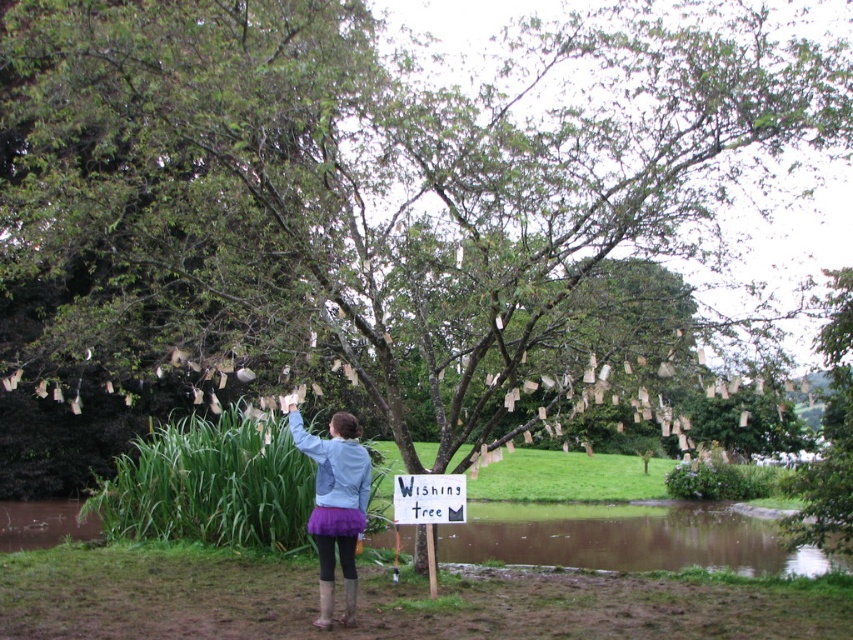
You are standing in the serene outdoor scene with the wishing tree. You see a point at coordinates point [357,502]. Can you reach that point with a 10 meter long fishing rod?

The point at coordinates point [357,502] is 7.65 meters away from you, so yes, you can reach it with a 10 meter long fishing rod since it is within the rod length.

You are standing in front of the wishing tree and notice two points marked on the ground. The first point is at coordinates point (x=338, y=452) and the second point is at point (x=447, y=476). Which point is closer to you?

Point (x=338, y=452) is closer to the viewer than point (x=447, y=476).